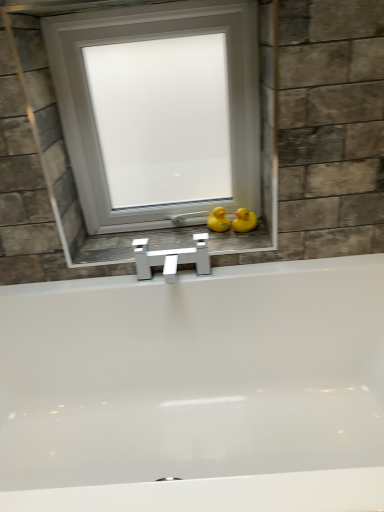
Question: Can you confirm if yellow rubber duck at center, the first duck in the left-to-right sequence, is smaller than yellow rubber duck at right, acting as the second duck starting from the left?

Choices:
 (A) no
 (B) yes

Answer: (B)

Question: Is yellow rubber duck at center, which is the 2th duck in right-to-left order, facing away from yellow rubber duck at right, the first duck when ordered from right to left?

Choices:
 (A) yes
 (B) no

Answer: (B)

Question: From the image's perspective, would you say yellow rubber duck at center, which is the 2th duck in right-to-left order, is positioned over yellow rubber duck at right, the first duck when ordered from right to left?

Choices:
 (A) no
 (B) yes

Answer: (B)

Question: Is yellow rubber duck at right, the first duck when ordered from right to left, completely or partially inside yellow rubber duck at center, which is the 2th duck in right-to-left order?

Choices:
 (A) no
 (B) yes

Answer: (A)

Question: Does yellow rubber duck at center, which is the 2th duck in right-to-left order, have a lesser height compared to yellow rubber duck at right, the first duck when ordered from right to left?

Choices:
 (A) yes
 (B) no

Answer: (B)

Question: In terms of size, does white glossy faucet at center appear bigger or smaller than yellow rubber duck at right, the first duck when ordered from right to left?

Choices:
 (A) big
 (B) small

Answer: (A)

Question: Is white glossy faucet at center inside the boundaries of yellow rubber duck at right, the first duck when ordered from right to left, or outside?

Choices:
 (A) inside
 (B) outside

Answer: (B)

Question: From a real-world perspective, is white glossy faucet at center above or below yellow rubber duck at right, acting as the second duck starting from the left?

Choices:
 (A) below
 (B) above

Answer: (A)

Question: Is white glossy faucet at center in front of or behind yellow rubber duck at right, the first duck when ordered from right to left, in the image?

Choices:
 (A) behind
 (B) front

Answer: (B)

Question: In the image, is yellow rubber duck at right, the first duck when ordered from right to left, positioned in front of or behind white matte window at center?

Choices:
 (A) behind
 (B) front

Answer: (A)

Question: Based on their positions, is yellow rubber duck at right, acting as the second duck starting from the left, located to the left or right of white matte window at center?

Choices:
 (A) left
 (B) right

Answer: (B)

Question: Based on their sizes in the image, would you say yellow rubber duck at right, the first duck when ordered from right to left, is bigger or smaller than white matte window at center?

Choices:
 (A) big
 (B) small

Answer: (B)

Question: Is yellow rubber duck at right, acting as the second duck starting from the left, taller or shorter than white matte window at center?

Choices:
 (A) tall
 (B) short

Answer: (B)

Question: Based on their sizes in the image, would you say yellow rubber duck at center, which is the 2th duck in right-to-left order, is bigger or smaller than white glossy faucet at center?

Choices:
 (A) big
 (B) small

Answer: (B)

Question: From a real-world perspective, is yellow rubber duck at center, the first duck in the left-to-right sequence, physically located above or below white glossy faucet at center?

Choices:
 (A) above
 (B) below

Answer: (A)